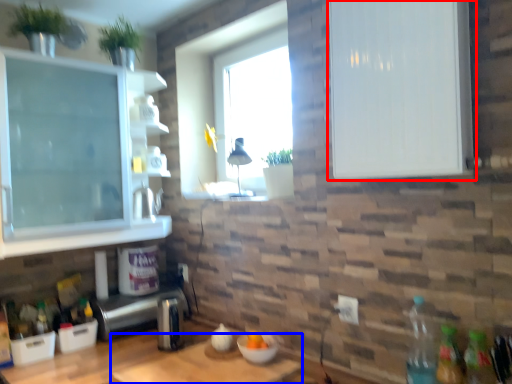
Question: Which object is closer to the camera taking this photo, cabinetry (highlighted by a red box) or table (highlighted by a blue box)?

Choices:
 (A) cabinetry
 (B) table

Answer: (A)